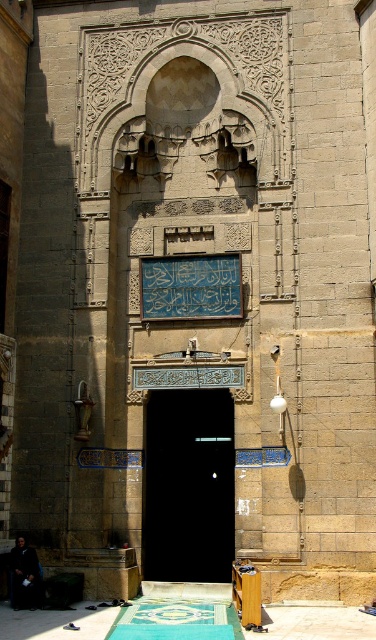
Does black glass door at center have a greater height compared to dark brown leather jacket at lower left?

Yes, black glass door at center is taller than dark brown leather jacket at lower left.

Is point (231, 486) in front of point (24, 595)?

No.

This screenshot has height=640, width=376. What do you see at coordinates (189, 486) in the screenshot? I see `black glass door at center` at bounding box center [189, 486].

This screenshot has height=640, width=376. I want to click on black glass door at center, so click(189, 486).

Which is behind, point (144, 557) or point (144, 618)?

The point (144, 557) is behind.

Between black glass door at center and green woven mat at lower center, which one has less height?

Standing shorter between the two is green woven mat at lower center.

Is point (192, 577) positioned before point (197, 625)?

No, it is behind (197, 625).

This screenshot has width=376, height=640. Identify the location of black glass door at center. (189, 486).

You are a GUI agent. You are given a task and a screenshot of the screen. Output one action in this format:
    pyautogui.click(x=<x>, y=<y>)
    Task: Click on the green woven mat at lower center
    
    Given the screenshot: What is the action you would take?
    pyautogui.click(x=175, y=620)

Does green woven mat at lower center have a larger size compared to dark brown leather jacket at lower left?

Yes, green woven mat at lower center is bigger than dark brown leather jacket at lower left.

Is point (175, 609) closer to viewer compared to point (18, 561)?

That is False.

Find the location of a particular element. This screenshot has height=640, width=376. green woven mat at lower center is located at coordinates (175, 620).